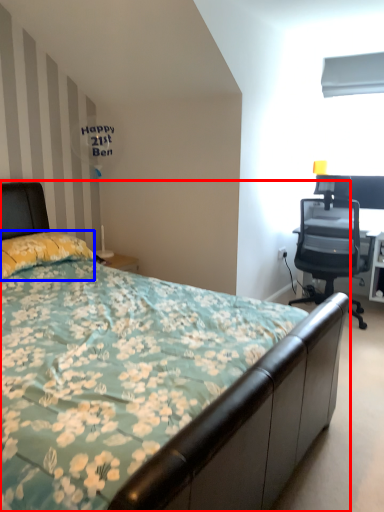
Question: Which point is closer to the camera, bed (highlighted by a red box) or pillow (highlighted by a blue box)?

Choices:
 (A) bed
 (B) pillow

Answer: (A)